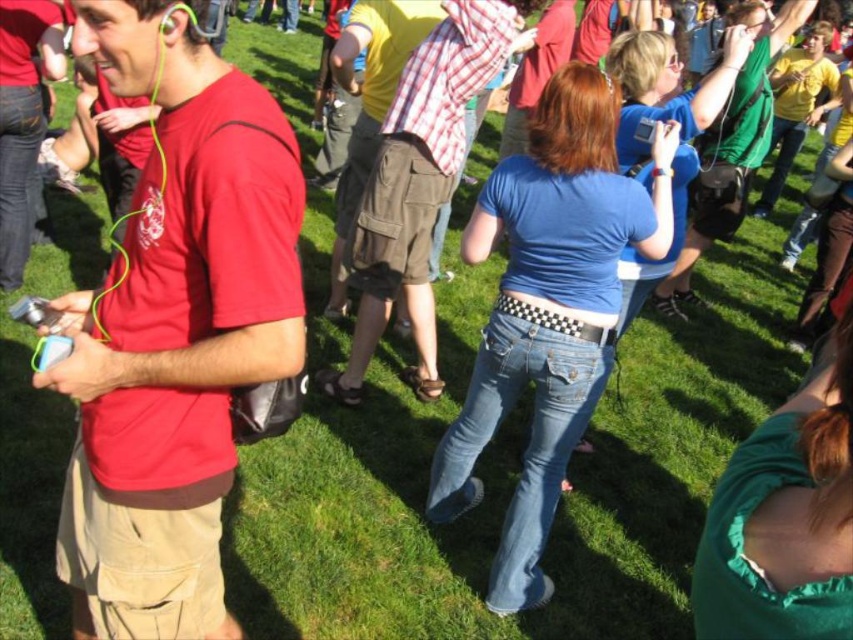
Between matte red t-shirt at left and green matte shirt at upper right, which one appears on the right side from the viewer's perspective?

Positioned to the right is green matte shirt at upper right.

Which is behind, point (155, 198) or point (751, 163)?

Positioned behind is point (751, 163).

You are a GUI agent. You are given a task and a screenshot of the screen. Output one action in this format:
    pyautogui.click(x=<x>, y=<y>)
    Task: Click on the matte red t-shirt at left
    
    Given the screenshot: What is the action you would take?
    pyautogui.click(x=173, y=330)